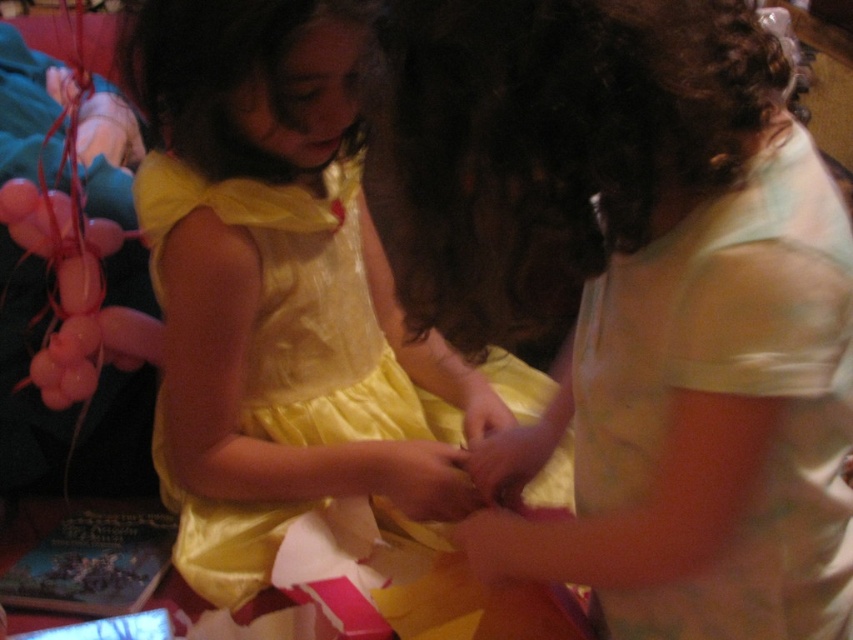
Who is taller, light green fabric shirt at center or yellow satin dress at center?

With more height is yellow satin dress at center.

Which is more to the right, light green fabric shirt at center or yellow satin dress at center?

Positioned to the right is light green fabric shirt at center.

Image resolution: width=853 pixels, height=640 pixels. Identify the location of light green fabric shirt at center. (637, 298).